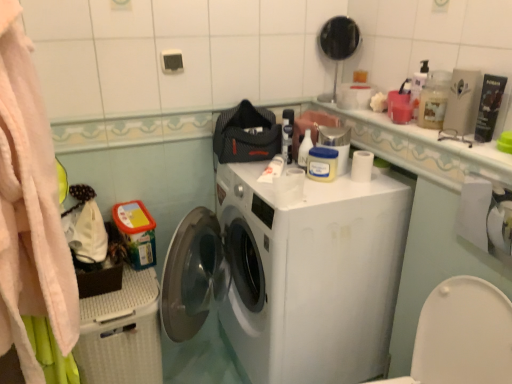
Question: Considering the positions of white matte toilet paper at lower right and white glossy bottle at upper center, marked as the first cleaning product in a back-to-front arrangement, in the image, is white matte toilet paper at lower right wider or thinner than white glossy bottle at upper center, marked as the first cleaning product in a back-to-front arrangement,?

Choices:
 (A) wide
 (B) thin

Answer: (A)

Question: Is white matte toilet paper at lower right situated inside white glossy bottle at upper center, which appears as the second cleaning product when viewed from the front, or outside?

Choices:
 (A) inside
 (B) outside

Answer: (B)

Question: Which of these objects is positioned closest to the white matte washing machine at center?

Choices:
 (A) metallic silver container at upper right
 (B) white glossy countertop at upper right
 (C) matte black mirror at upper center
 (D) white matte toilet paper at lower right
 (E) white glossy bottle at upper center, which appears as the second cleaning product when viewed from the front

Answer: (A)

Question: Estimate the real-world distances between objects in this image. Which object is farther from the white matte toilet paper at lower right?

Choices:
 (A) metallic silver container at upper right
 (B) white glossy countertop at upper right
 (C) matte black mirror at upper center
 (D) soft pink towel at left
 (E) white glossy bottle at upper center, acting as the 2th cleaning product starting from the right

Answer: (D)